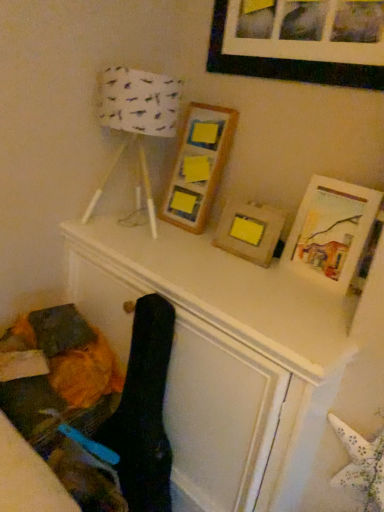
Describe the element at coordinates (331, 231) in the screenshot. I see `matte wooden picture frame at upper right, arranged as the 4th picture frame when viewed from the top` at that location.

Describe the element at coordinates (249, 230) in the screenshot. I see `wooden picture frame at center, which appears as the third picture frame when viewed from the top` at that location.

Find the location of `white paper lampshade at upper left`. white paper lampshade at upper left is located at coordinates (136, 123).

What is the approximate height of wooden frame at center, which appears as the second picture frame when viewed from the top?

wooden frame at center, which appears as the second picture frame when viewed from the top, is 22.93 inches in height.

The image size is (384, 512). I want to click on matte wooden picture frame at upper right, arranged as the 4th picture frame when viewed from the top, so tap(331, 231).

Is point (298, 75) closer or farther from the camera than point (354, 201)?

Clearly, point (298, 75) is more distant from the camera than point (354, 201).

Is black matte picture frame at upper center, placed as the 4th picture frame when sorted from bottom to top, positioned beyond the bounds of matte wooden picture frame at upper right, positioned as the 1th picture frame in bottom-to-top order?

That's correct, black matte picture frame at upper center, placed as the 4th picture frame when sorted from bottom to top, is outside of matte wooden picture frame at upper right, positioned as the 1th picture frame in bottom-to-top order.

Locate an element on the screen. picture frame in front of the matte wooden picture frame at upper right, positioned as the 1th picture frame in bottom-to-top order is located at coordinates (286, 63).

Does wooden frame at center, the 3th picture frame positioned from the bottom, have a smaller size compared to wooden picture frame at center, which is the second picture frame in bottom-to-top order?

No, wooden frame at center, the 3th picture frame positioned from the bottom, is not smaller than wooden picture frame at center, which is the second picture frame in bottom-to-top order.

Could you measure the distance between wooden frame at center, the 3th picture frame positioned from the bottom, and wooden picture frame at center, which is the second picture frame in bottom-to-top order?

10.23 inches.

Is wooden frame at center, which appears as the second picture frame when viewed from the top, oriented towards wooden picture frame at center, which appears as the third picture frame when viewed from the top?

No, wooden frame at center, which appears as the second picture frame when viewed from the top, does not turn towards wooden picture frame at center, which appears as the third picture frame when viewed from the top.

Between black matte picture frame at upper center, placed as the 4th picture frame when sorted from bottom to top, and white paper lampshade at upper left, which one appears on the left side from the viewer's perspective?

From the viewer's perspective, white paper lampshade at upper left appears more on the left side.

From the image's perspective, does black matte picture frame at upper center, placed as the 4th picture frame when sorted from bottom to top, appear higher than white paper lampshade at upper left?

Yes, from the image's perspective, black matte picture frame at upper center, placed as the 4th picture frame when sorted from bottom to top, is on top of white paper lampshade at upper left.

Looking at their sizes, would you say black matte picture frame at upper center, placed as the 4th picture frame when sorted from bottom to top, is wider or thinner than white paper lampshade at upper left?

Considering their sizes, black matte picture frame at upper center, placed as the 4th picture frame when sorted from bottom to top, looks slimmer than white paper lampshade at upper left.

From a real-world perspective, is black matte picture frame at upper center, which ranks as the first picture frame in top-to-bottom order, physically below white paper lampshade at upper left?

No, from a real-world perspective, black matte picture frame at upper center, which ranks as the first picture frame in top-to-bottom order, is not beneath white paper lampshade at upper left.

Measure the distance from wooden picture frame at center, which appears as the third picture frame when viewed from the top, to white paper lampshade at upper left.

17.40 inches.

From a real-world perspective, which object stands above the other?

In real-world perspective, white paper lampshade at upper left is above.

Choose the correct answer: Is wooden picture frame at center, which appears as the third picture frame when viewed from the top, inside white paper lampshade at upper left or outside it?

wooden picture frame at center, which appears as the third picture frame when viewed from the top, is spatially situated outside white paper lampshade at upper left.

Locate an element on the screen. The height and width of the screenshot is (512, 384). the 2nd picture frame to the right of the white paper lampshade at upper left, starting your count from the anchor is located at coordinates (249, 230).

From the white paper lampshade at upper left, count 2nd picture frames backward and point to it. Please provide its 2D coordinates.

[(198, 165)]

Are wooden frame at center, which appears as the second picture frame when viewed from the top, and white paper lampshade at upper left beside each other?

They are not placed beside each other.

Which is behind, wooden frame at center, which appears as the second picture frame when viewed from the top, or white paper lampshade at upper left?

wooden frame at center, which appears as the second picture frame when viewed from the top.

Does black matte picture frame at upper center, placed as the 4th picture frame when sorted from bottom to top, have a greater width compared to wooden picture frame at center, which is the second picture frame in bottom-to-top order?

No, black matte picture frame at upper center, placed as the 4th picture frame when sorted from bottom to top, is not wider than wooden picture frame at center, which is the second picture frame in bottom-to-top order.

Is the surface of black matte picture frame at upper center, which ranks as the first picture frame in top-to-bottom order, in direct contact with wooden picture frame at center, which is the second picture frame in bottom-to-top order?

black matte picture frame at upper center, which ranks as the first picture frame in top-to-bottom order, and wooden picture frame at center, which is the second picture frame in bottom-to-top order, are not in contact.

From the picture: Can you confirm if black matte picture frame at upper center, which ranks as the first picture frame in top-to-bottom order, is taller than wooden picture frame at center, which appears as the third picture frame when viewed from the top?

Indeed, black matte picture frame at upper center, which ranks as the first picture frame in top-to-bottom order, has a greater height compared to wooden picture frame at center, which appears as the third picture frame when viewed from the top.

Does black matte picture frame at upper center, placed as the 4th picture frame when sorted from bottom to top, have a smaller size compared to wooden picture frame at center, which is the second picture frame in bottom-to-top order?

Actually, black matte picture frame at upper center, placed as the 4th picture frame when sorted from bottom to top, might be larger than wooden picture frame at center, which is the second picture frame in bottom-to-top order.

Is matte wooden picture frame at upper right, positioned as the 1th picture frame in bottom-to-top order, far from black matte picture frame at upper center, placed as the 4th picture frame when sorted from bottom to top?

No.

Does matte wooden picture frame at upper right, positioned as the 1th picture frame in bottom-to-top order, appear on the left side of black matte picture frame at upper center, placed as the 4th picture frame when sorted from bottom to top?

Incorrect, matte wooden picture frame at upper right, positioned as the 1th picture frame in bottom-to-top order, is not on the left side of black matte picture frame at upper center, placed as the 4th picture frame when sorted from bottom to top.

From the image's perspective, relative to black matte picture frame at upper center, placed as the 4th picture frame when sorted from bottom to top, is matte wooden picture frame at upper right, positioned as the 1th picture frame in bottom-to-top order, above or below?

matte wooden picture frame at upper right, positioned as the 1th picture frame in bottom-to-top order, is below black matte picture frame at upper center, placed as the 4th picture frame when sorted from bottom to top.

Which of these two, matte wooden picture frame at upper right, positioned as the 1th picture frame in bottom-to-top order, or black matte picture frame at upper center, which ranks as the first picture frame in top-to-bottom order, is smaller?

black matte picture frame at upper center, which ranks as the first picture frame in top-to-bottom order.

This screenshot has height=512, width=384. In order to click on picture frame that is the 3rd one when counting upward from the matte wooden picture frame at upper right, arranged as the 4th picture frame when viewed from the top (from the image's perspective) in this screenshot , I will do `click(286, 63)`.

From a real-world perspective, count 2nd picture frames upward from the wooden picture frame at center, which is the second picture frame in bottom-to-top order, and point to it. Please provide its 2D coordinates.

[(198, 165)]

Based on their spatial positions, is wooden picture frame at center, which is the second picture frame in bottom-to-top order, or matte wooden picture frame at upper right, arranged as the 4th picture frame when viewed from the top, further from white paper lampshade at upper left?

matte wooden picture frame at upper right, arranged as the 4th picture frame when viewed from the top, is further to white paper lampshade at upper left.

From the image, which object appears to be nearer to wooden frame at center, the 3th picture frame positioned from the bottom, wooden picture frame at center, which appears as the third picture frame when viewed from the top, or white paper lampshade at upper left?

white paper lampshade at upper left.

From the image, which object appears to be nearer to black matte picture frame at upper center, placed as the 4th picture frame when sorted from bottom to top, wooden picture frame at center, which is the second picture frame in bottom-to-top order, or matte wooden picture frame at upper right, arranged as the 4th picture frame when viewed from the top?

matte wooden picture frame at upper right, arranged as the 4th picture frame when viewed from the top, is closer to black matte picture frame at upper center, placed as the 4th picture frame when sorted from bottom to top.

Consider the image. From the image, which object appears to be nearer to wooden frame at center, which appears as the second picture frame when viewed from the top, matte wooden picture frame at upper right, arranged as the 4th picture frame when viewed from the top, or white paper lampshade at upper left?

white paper lampshade at upper left.

Consider the image. Which object lies further to the anchor point wooden picture frame at center, which is the second picture frame in bottom-to-top order, white paper lampshade at upper left or wooden frame at center, the 3th picture frame positioned from the bottom?

Based on the image, white paper lampshade at upper left appears to be further to wooden picture frame at center, which is the second picture frame in bottom-to-top order.

Which object lies further to the anchor point wooden frame at center, the 3th picture frame positioned from the bottom, matte wooden picture frame at upper right, positioned as the 1th picture frame in bottom-to-top order, or wooden picture frame at center, which is the second picture frame in bottom-to-top order?

Answer: matte wooden picture frame at upper right, positioned as the 1th picture frame in bottom-to-top order, lies further to wooden frame at center, the 3th picture frame positioned from the bottom, than the other object.

From the image, which object appears to be farther from white paper lampshade at upper left, black matte picture frame at upper center, which ranks as the first picture frame in top-to-bottom order, or matte wooden picture frame at upper right, arranged as the 4th picture frame when viewed from the top?

Based on the image, matte wooden picture frame at upper right, arranged as the 4th picture frame when viewed from the top, appears to be further to white paper lampshade at upper left.

When comparing their distances from white paper lampshade at upper left, does wooden frame at center, the 3th picture frame positioned from the bottom, or matte wooden picture frame at upper right, arranged as the 4th picture frame when viewed from the top, seem closer?

wooden frame at center, the 3th picture frame positioned from the bottom, is positioned closer to the anchor white paper lampshade at upper left.

This screenshot has width=384, height=512. What are the coordinates of `table lamp between black matte picture frame at upper center, placed as the 4th picture frame when sorted from bottom to top, and wooden picture frame at center, which is the second picture frame in bottom-to-top order, vertically` in the screenshot? It's located at (136, 123).

Find the location of `picture frame that lies between black matte picture frame at upper center, placed as the 4th picture frame when sorted from bottom to top, and wooden picture frame at center, which appears as the third picture frame when viewed from the top, from top to bottom`. picture frame that lies between black matte picture frame at upper center, placed as the 4th picture frame when sorted from bottom to top, and wooden picture frame at center, which appears as the third picture frame when viewed from the top, from top to bottom is located at coordinates (198, 165).

Where is `picture frame located between white paper lampshade at upper left and wooden picture frame at center, which is the second picture frame in bottom-to-top order, in the left-right direction`? picture frame located between white paper lampshade at upper left and wooden picture frame at center, which is the second picture frame in bottom-to-top order, in the left-right direction is located at coordinates (198, 165).